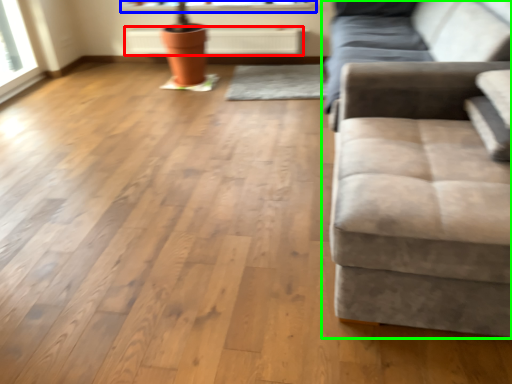
Question: Estimate the real-world distances between objects in this image. Which object is farther from radiator (highlighted by a red box), window sill (highlighted by a blue box) or studio couch (highlighted by a green box)?

Choices:
 (A) window sill
 (B) studio couch

Answer: (B)